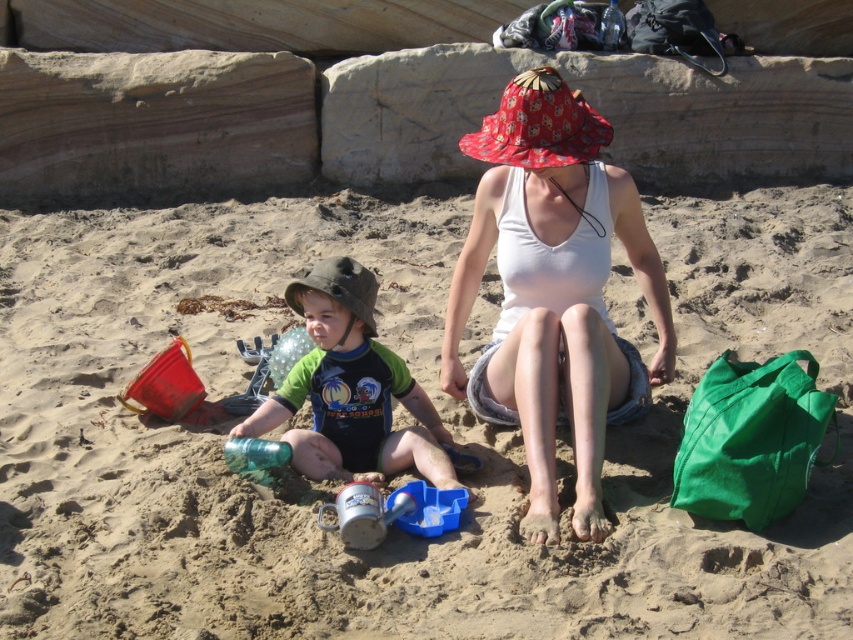
Measure the distance between white cotton tank top at center and camera.

white cotton tank top at center and camera are 12.84 feet apart.

Which of these two, white cotton tank top at center or green matte swimsuit at left, stands shorter?

green matte swimsuit at left

Consider the image. Who is more distant from viewer, [473,211] or [447,472]?

Point [473,211]

The width and height of the screenshot is (853, 640). In order to click on white cotton tank top at center in this screenshot , I will do `click(553, 291)`.

Does fine-grained sand at center lie behind green matte swimsuit at left?

No, it is not.

Is fine-grained sand at center bigger than green matte swimsuit at left?

Incorrect, fine-grained sand at center is not larger than green matte swimsuit at left.

Is point (624, 577) farther from camera compared to point (315, 467)?

No.

This screenshot has width=853, height=640. What are the coordinates of `fine-grained sand at center` in the screenshot? It's located at (436, 406).

Which is above, fine-grained sand at center or white cotton tank top at center?

white cotton tank top at center

Describe the element at coordinates (436, 406) in the screenshot. I see `fine-grained sand at center` at that location.

Identify the location of fine-grained sand at center. (436, 406).